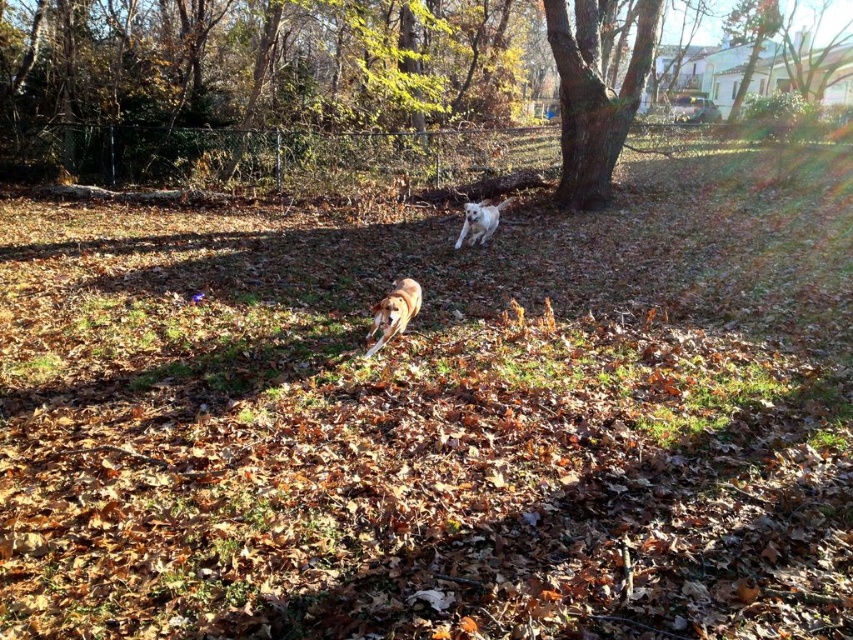
Question: Among these points, which one is nearest to the camera?

Choices:
 (A) (560, 52)
 (B) (376, 346)
 (C) (517, 29)
 (D) (480, 211)

Answer: (B)

Question: Among these points, which one is farthest from the camera?

Choices:
 (A) (660, 0)
 (B) (25, 81)
 (C) (486, 214)

Answer: (B)

Question: Considering the relative positions of brown rough bark tree at upper center and brown furry dog at center in the image provided, where is brown rough bark tree at upper center located with respect to brown furry dog at center?

Choices:
 (A) right
 (B) left

Answer: (A)

Question: Which point is farther from the camera taking this photo?

Choices:
 (A) (178, 128)
 (B) (498, 214)
 (C) (409, 305)

Answer: (A)

Question: Can you confirm if brown textured tree at center is positioned to the left of brown rough bark tree at upper center?

Choices:
 (A) no
 (B) yes

Answer: (A)

Question: In this image, where is brown textured tree at center located relative to brown furry dog at center?

Choices:
 (A) right
 (B) left

Answer: (A)